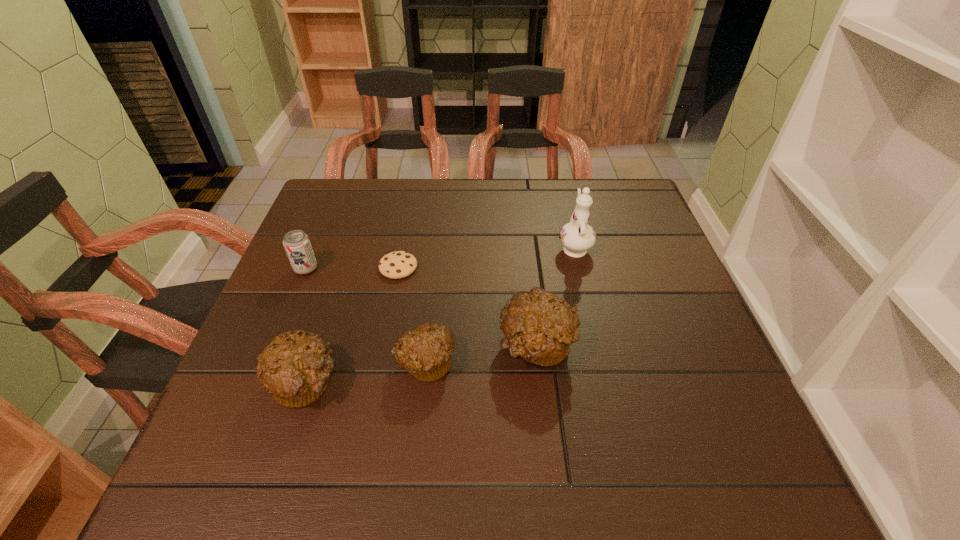
In order to click on free location located on the left of the rightmost muffin in this screenshot , I will do `click(469, 346)`.

Locate an element on the screen. free space located 0.190m on the front of the beer can is located at coordinates (276, 340).

The height and width of the screenshot is (540, 960). What are the coordinates of `vacant space located 0.230m at the spout of the tallest object` in the screenshot? It's located at (560, 186).

You are a GUI agent. You are given a task and a screenshot of the screen. Output one action in this format:
    pyautogui.click(x=<x>, y=<y>)
    Task: Click on the vacant space situated 0.210m at the spout of the tallest object
    The height and width of the screenshot is (540, 960).
    Given the screenshot: What is the action you would take?
    pyautogui.click(x=561, y=190)

In order to click on free space located 0.180m at the spout of the tallest object in this screenshot , I will do `click(562, 195)`.

Where is `free spot located 0.060m on the right of the shortest object`? free spot located 0.060m on the right of the shortest object is located at coordinates (442, 267).

Identify the location of muffin that is at the left edge. (295, 368).

Find the location of a particular element. Image resolution: width=960 pixels, height=540 pixels. beer can at the left edge is located at coordinates (297, 245).

Locate an element on the screen. This screenshot has width=960, height=540. object located in the near left corner section of the desktop is located at coordinates [x=295, y=368].

Find the location of a particular element. The width and height of the screenshot is (960, 540). free space at the far edge of the desktop is located at coordinates (532, 188).